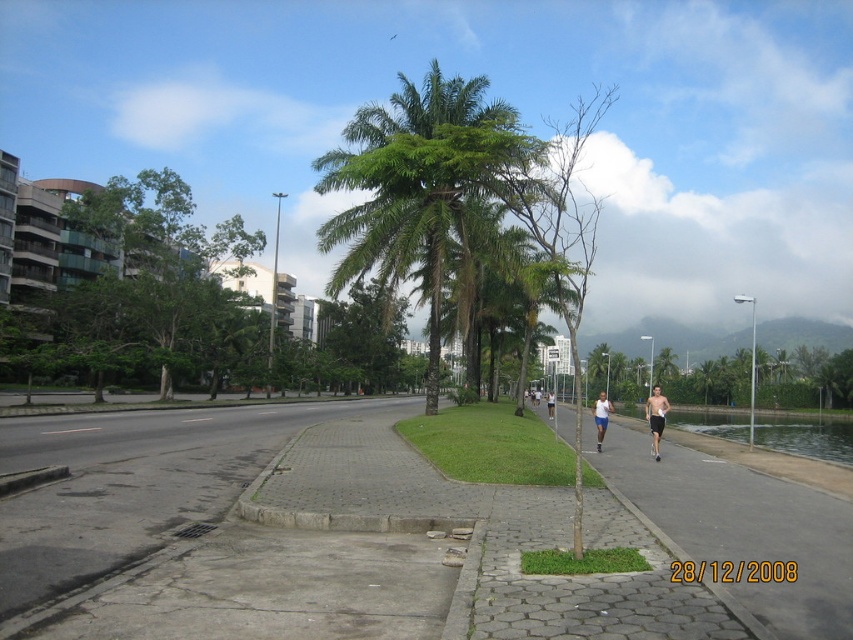
You are standing at the point closer to the camera in the image. Which point are you at, point (664, 412) or point (552, 413)?

You are at point (664, 412) because it is closer to the camera than point (552, 413).